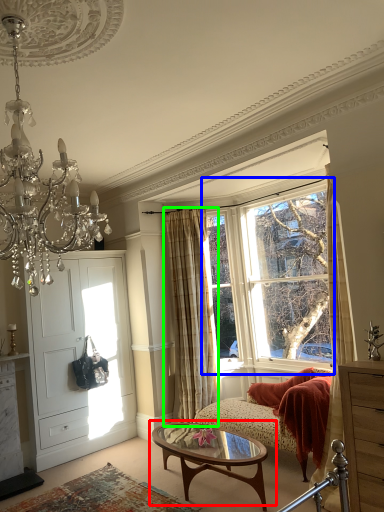
Question: Based on their relative distances, which object is farther from coffee table (highlighted by a red box)? Choose from window (highlighted by a blue box) and curtain (highlighted by a green box).

Choices:
 (A) window
 (B) curtain

Answer: (A)